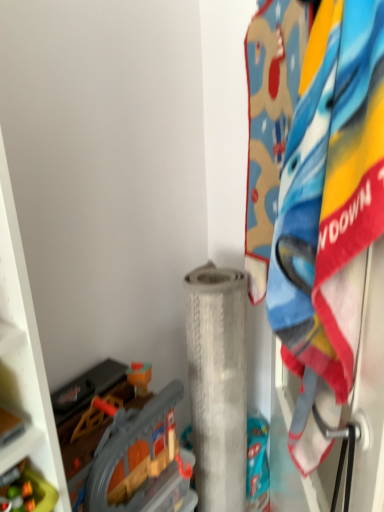
Question: Does translucent plastic toy at lower left, which ranks as the second toy in back-to-front order, have a greater width compared to white textured roll at center?

Choices:
 (A) no
 (B) yes

Answer: (A)

Question: From a real-world perspective, is translucent plastic toy at lower left, which ranks as the second toy in back-to-front order, under white textured roll at center?

Choices:
 (A) yes
 (B) no

Answer: (B)

Question: Is translucent plastic toy at lower left, positioned as the first toy in front-to-back order, outside white textured roll at center?

Choices:
 (A) yes
 (B) no

Answer: (A)

Question: From the image's perspective, is translucent plastic toy at lower left, which ranks as the second toy in back-to-front order, beneath white textured roll at center?

Choices:
 (A) no
 (B) yes

Answer: (A)

Question: Is there a large distance between translucent plastic toy at lower left, which ranks as the second toy in back-to-front order, and white textured roll at center?

Choices:
 (A) no
 (B) yes

Answer: (A)

Question: Can you confirm if translucent plastic toy at lower left, which ranks as the second toy in back-to-front order, is shorter than white textured roll at center?

Choices:
 (A) no
 (B) yes

Answer: (B)

Question: From the image's perspective, is plastic gray train set at lower left, which appears as the second toy when viewed from the front, on translucent plastic toy at lower left, which ranks as the second toy in back-to-front order?

Choices:
 (A) yes
 (B) no

Answer: (B)

Question: Is there a large distance between plastic gray train set at lower left, which appears as the second toy when viewed from the front, and translucent plastic toy at lower left, which ranks as the second toy in back-to-front order?

Choices:
 (A) yes
 (B) no

Answer: (B)

Question: Is plastic gray train set at lower left, which appears as the second toy when viewed from the front, not within translucent plastic toy at lower left, positioned as the first toy in front-to-back order?

Choices:
 (A) no
 (B) yes

Answer: (B)

Question: Can you confirm if plastic gray train set at lower left, which appears as the second toy when viewed from the front, is wider than translucent plastic toy at lower left, which ranks as the second toy in back-to-front order?

Choices:
 (A) yes
 (B) no

Answer: (A)

Question: Can you confirm if plastic gray train set at lower left, which appears as the second toy when viewed from the front, is shorter than translucent plastic toy at lower left, positioned as the first toy in front-to-back order?

Choices:
 (A) yes
 (B) no

Answer: (B)

Question: From the image's perspective, is plastic gray train set at lower left, which appears as the second toy when viewed from the front, beneath translucent plastic toy at lower left, positioned as the first toy in front-to-back order?

Choices:
 (A) no
 (B) yes

Answer: (B)

Question: Is plastic gray train set at lower left, which appears as the 1th toy when viewed from the back, facing away from white textured roll at center?

Choices:
 (A) no
 (B) yes

Answer: (A)